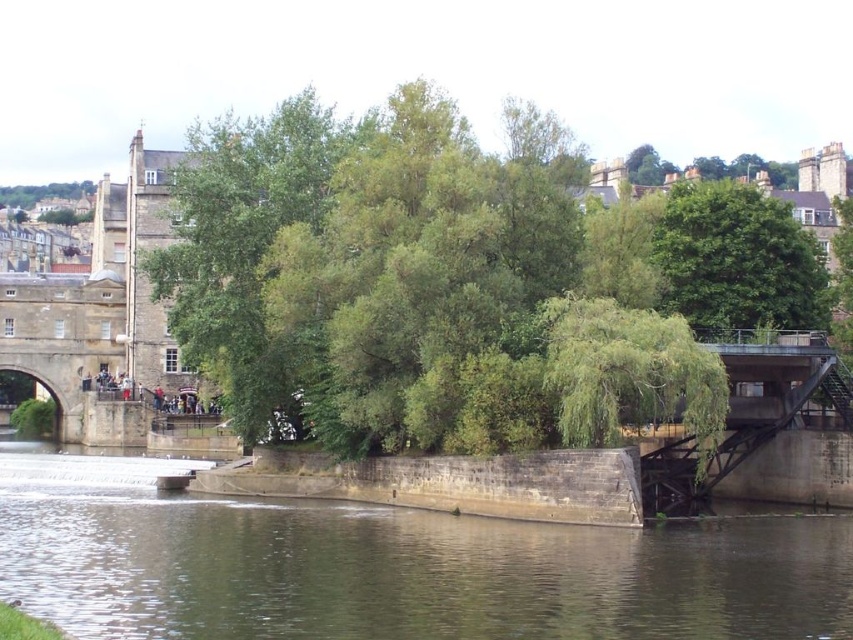
You are a painter standing on the riverbank and want to paint the brown stone river at center and the green leafy tree at upper left. Which one should you focus on first if you want to paint the wider object?

The brown stone river at center should be focused on first because its width is larger than the green leafy tree at upper left.